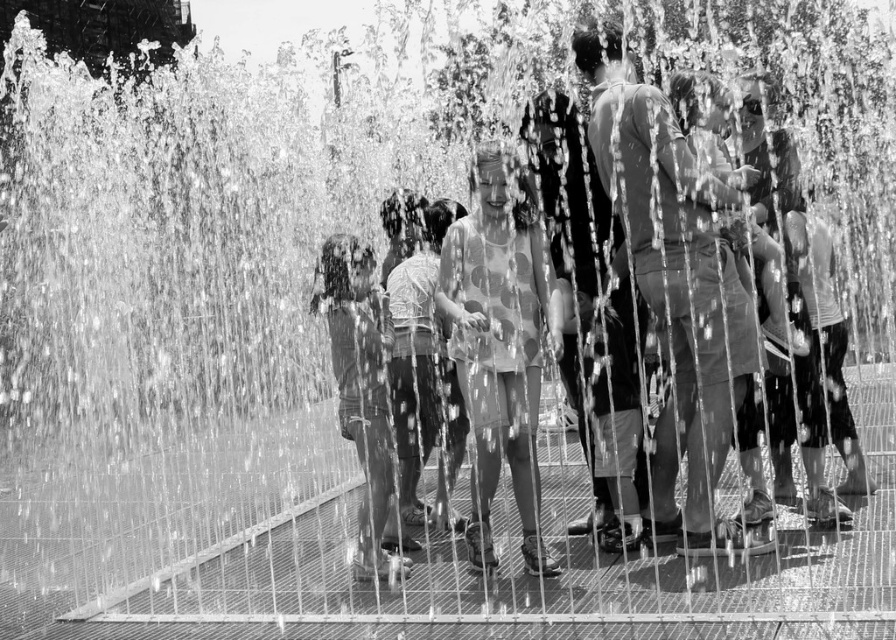
Question: Can you confirm if matte gray shorts at center is positioned to the right of polka dot fabric dress at center?

Choices:
 (A) no
 (B) yes

Answer: (B)

Question: Does matte gray shorts at center have a lesser width compared to smooth fabric shirt at center?

Choices:
 (A) yes
 (B) no

Answer: (B)

Question: Which point appears farthest from the camera in this image?

Choices:
 (A) (517, 208)
 (B) (381, 472)

Answer: (A)

Question: Which object is closer to the camera taking this photo?

Choices:
 (A) matte gray shorts at center
 (B) polka dot fabric dress at center

Answer: (A)

Question: Does polka dot fabric dress at center appear under smooth fabric shirt at center?

Choices:
 (A) yes
 (B) no

Answer: (B)

Question: Considering the real-world distances, which object is farthest from the smooth fabric shirt at center?

Choices:
 (A) polka dot fabric dress at center
 (B) matte gray shorts at center

Answer: (B)